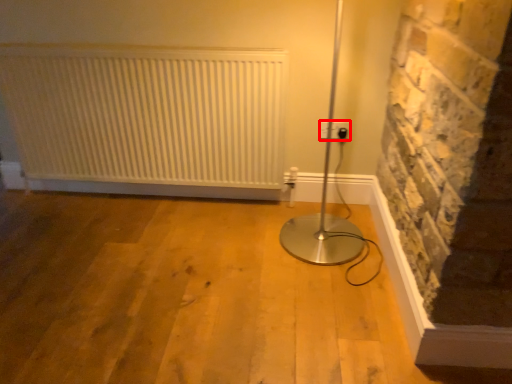
Question: Where is electric outlet (annotated by the red box) located in relation to radiator in the image?

Choices:
 (A) left
 (B) right

Answer: (B)